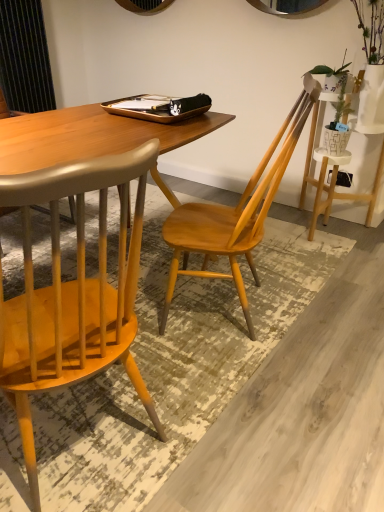
Where is `free space that is in between light wood chair at center, the first chair from the right, and wooden chair at left, which is counted as the first chair, starting from the left`? This screenshot has width=384, height=512. free space that is in between light wood chair at center, the first chair from the right, and wooden chair at left, which is counted as the first chair, starting from the left is located at coordinates (190, 368).